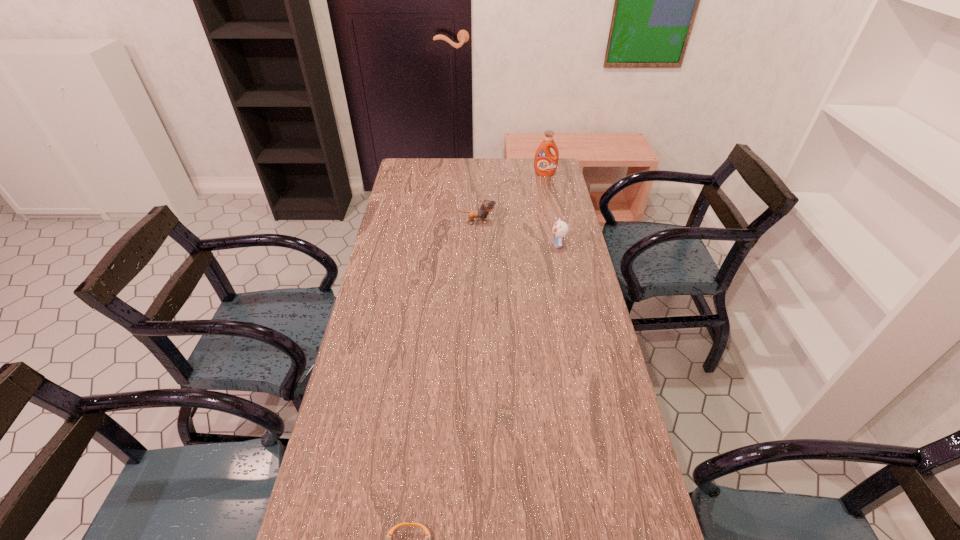
Locate an element on the screen. the tallest object is located at coordinates (545, 163).

Find the location of a particular element. detergent is located at coordinates (545, 163).

You are a GUI agent. You are given a task and a screenshot of the screen. Output one action in this format:
    pyautogui.click(x=<x>, y=<y>)
    Task: Click on the second nearest object
    
    Given the screenshot: What is the action you would take?
    pyautogui.click(x=560, y=229)

Where is `the nearer kitten`? The image size is (960, 540). the nearer kitten is located at coordinates (560, 229).

Locate an element on the screen. Image resolution: width=960 pixels, height=540 pixels. the left kitten is located at coordinates (487, 206).

Locate an element on the screen. The image size is (960, 540). the farther kitten is located at coordinates (487, 206).

Identify the location of free space located on the front-facing side of the farthest object. (547, 187).

The image size is (960, 540). What are the coordinates of `free space located on the front-facing side of the nearer kitten` in the screenshot? It's located at point(503,245).

Locate an element on the screen. free space located on the front-facing side of the nearer kitten is located at coordinates (454, 245).

Identify the location of vacant area located 0.060m on the front-facing side of the nearer kitten. (534, 245).